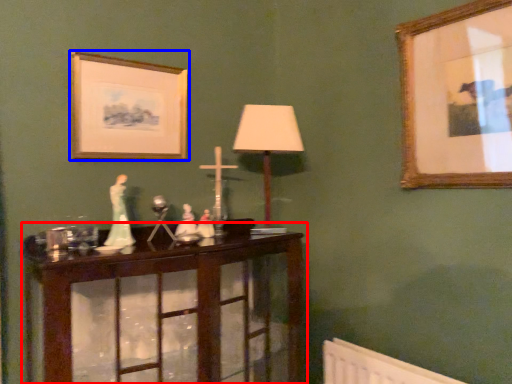
Question: Among these objects, which one is farthest to the camera, table (highlighted by a red box) or picture frame (highlighted by a blue box)?

Choices:
 (A) table
 (B) picture frame

Answer: (B)